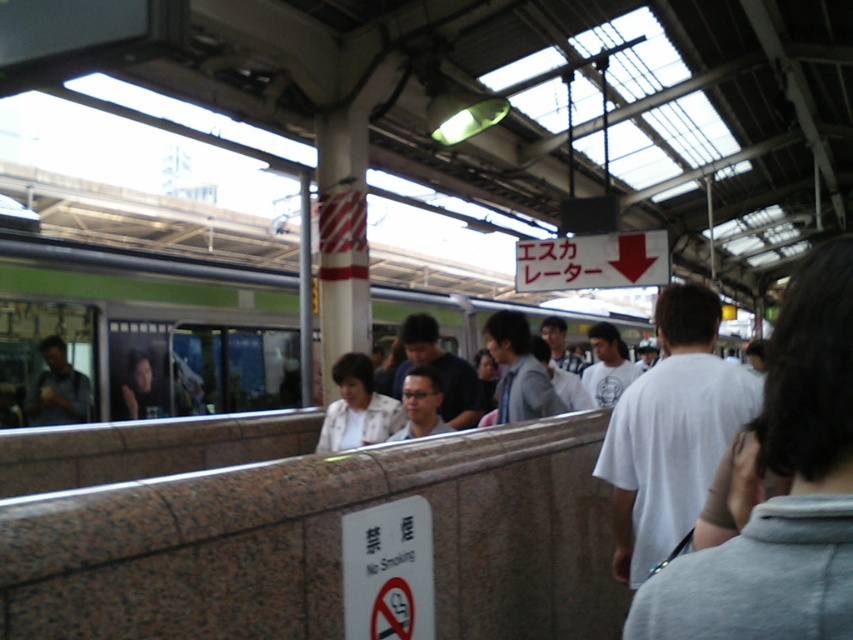
You are a photographer trying to capture a candid shot of the white textured jacket at center and the light gray shirt at center in the train station scene. Given that your camera has a maximum focus range of 30 inches, will you be able to capture both subjects clearly in the same frame without adjusting your position?

The white textured jacket at center and light gray shirt at center are 30.61 inches apart. Since the distance between them exceeds the camera maximum focus range of 30 inches, you will need to adjust your position to ensure both subjects are within the 30 inch range for clear capture.

You are a commuter waiting on the platform. You notice a green metallic train at center and a light gray shirt at center. Which object is bigger in size?

The green metallic train at center is larger in size compared to the light gray shirt at center.

You are standing on the train station platform and see two points marked on the ground. One is at coordinates point (181, 243) and the other is at point (519, 337). If you are facing the train, which point is closer to the train?

Point (181, 243) is behind point (519, 337), so if you are facing the train, the point closer to the train would be point (519, 337).